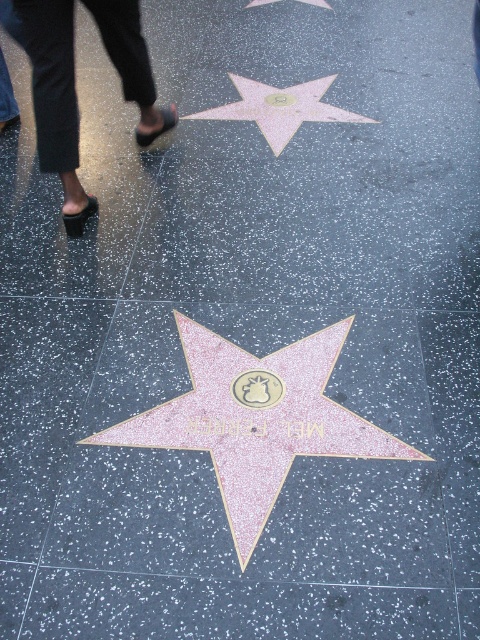
Does pink glitter star at center appear under black leather sandals at upper left?

Yes.

Is point (261, 452) positioned after point (39, 49)?

No, (261, 452) is in front of (39, 49).

This screenshot has height=640, width=480. I want to click on pink glitter star at center, so click(255, 419).

Does pink glittery star at upper center have a lesser width compared to pink glittery star at center?

In fact, pink glittery star at upper center might be wider than pink glittery star at center.

Is point (222, 106) behind point (256, 4)?

No, it is in front of (256, 4).

Is point (345, 113) farther from viewer compared to point (264, 3)?

No, it is in front of (264, 3).

What are the coordinates of `pink glittery star at upper center` in the screenshot? It's located at click(279, 108).

Can you confirm if pink glitter star at center is positioned above pink glittery star at upper center?

Incorrect, pink glitter star at center is not positioned above pink glittery star at upper center.

At what (x,y) coordinates should I click in order to perform the action: click on pink glitter star at center. Please return your answer as a coordinate pair (x, y). Image resolution: width=480 pixels, height=640 pixels. Looking at the image, I should click on (255, 419).

I want to click on pink glitter star at center, so tap(255, 419).